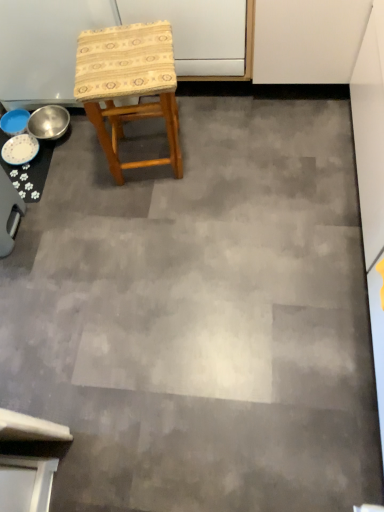
In order to click on vacant point to the left of woven fabric stool at center in this screenshot , I will do `click(83, 179)`.